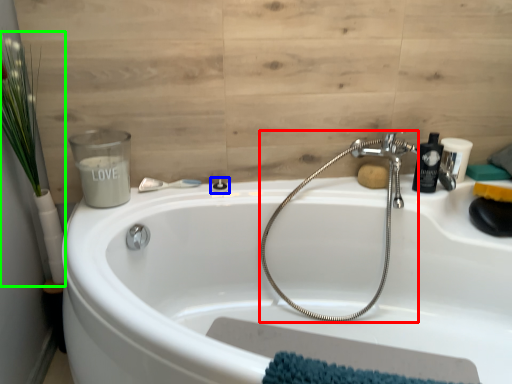
Question: Which object is the farthest from plumbing fixture (highlighted by a red box)? Choose among these: shower (highlighted by a blue box) or plant (highlighted by a green box).

Choices:
 (A) shower
 (B) plant

Answer: (B)